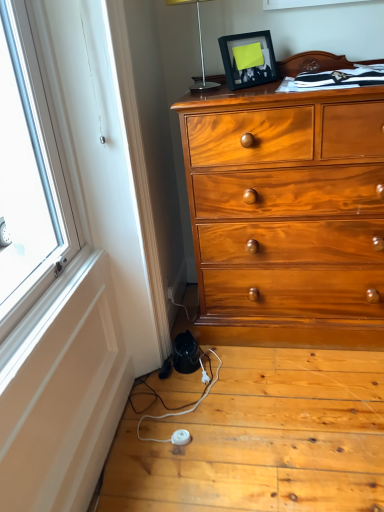
This screenshot has height=512, width=384. Find the location of `silver metallic table lamp at upper center`. silver metallic table lamp at upper center is located at coordinates (200, 50).

Describe the element at coordinates (182, 410) in the screenshot. I see `white plastic power strip at lower center` at that location.

This screenshot has height=512, width=384. Find the location of `black matte picture frame at upper center`. black matte picture frame at upper center is located at coordinates (251, 64).

Locate an element on the screen. silver metallic table lamp at upper center is located at coordinates (200, 50).

Is black matte picture frame at upper center positioned behind silver metallic table lamp at upper center?

Yes.

From a real-world perspective, is black matte picture frame at upper center above or below silver metallic table lamp at upper center?

In terms of real-world spatial position, black matte picture frame at upper center is below silver metallic table lamp at upper center.

From the image's perspective, between black matte picture frame at upper center and silver metallic table lamp at upper center, who is located below?

black matte picture frame at upper center appears lower in the image.

Does black matte picture frame at upper center have a lesser height compared to silver metallic table lamp at upper center?

Yes, black matte picture frame at upper center is shorter than silver metallic table lamp at upper center.

Is point (208, 392) more distant than point (249, 72)?

Yes.

Is the surface of white plastic power strip at lower center in direct contact with black matte picture frame at upper center?

white plastic power strip at lower center and black matte picture frame at upper center are not in contact.

From a real-world perspective, does white plastic power strip at lower center stand above black matte picture frame at upper center?

No, from a real-world perspective, white plastic power strip at lower center is not over black matte picture frame at upper center

This screenshot has width=384, height=512. I want to click on twin below the black matte picture frame at upper center (from a real-world perspective), so 182,410.

In order to click on table lamp behind the white plastic power strip at lower center in this screenshot , I will do `click(200, 50)`.

Is point (204, 393) closer to camera compared to point (199, 91)?

No, it is not.

From a real-world perspective, who is located lower, white plastic power strip at lower center or silver metallic table lamp at upper center?

In real-world perspective, white plastic power strip at lower center is lower.

Considering the sizes of objects white plastic power strip at lower center and silver metallic table lamp at upper center in the image provided, who is bigger, white plastic power strip at lower center or silver metallic table lamp at upper center?

silver metallic table lamp at upper center is bigger.

Image resolution: width=384 pixels, height=512 pixels. Identify the location of picture frame located on the right of silver metallic table lamp at upper center. (251, 64).

Which object is closer to the camera, silver metallic table lamp at upper center or black matte picture frame at upper center?

silver metallic table lamp at upper center.

In terms of width, does silver metallic table lamp at upper center look wider or thinner when compared to black matte picture frame at upper center?

In the image, silver metallic table lamp at upper center appears to be wider than black matte picture frame at upper center.

Is black matte picture frame at upper center in contact with white plastic power strip at lower center?

No, black matte picture frame at upper center is not beside white plastic power strip at lower center.

From a real-world perspective, which object stands above the other?

black matte picture frame at upper center.

Locate an element on the screen. picture frame positioned vertically above the white plastic power strip at lower center (from a real-world perspective) is located at coordinates (251, 64).

Between point (234, 74) and point (218, 358), which one is positioned in front?

The point (234, 74) is more forward.

Looking at this image, which is correct: silver metallic table lamp at upper center is inside white plastic power strip at lower center, or outside of it?

silver metallic table lamp at upper center is not inside white plastic power strip at lower center, it's outside.

Is point (199, 31) in front of point (160, 416)?

No, it is not.

What are the coordinates of `twin located on the left of silver metallic table lamp at upper center` in the screenshot? It's located at (182, 410).

Is silver metallic table lamp at upper center looking in the opposite direction of white plastic power strip at lower center?

silver metallic table lamp at upper center is not turned away from white plastic power strip at lower center.

Locate an element on the screen. picture frame below the silver metallic table lamp at upper center (from a real-world perspective) is located at coordinates point(251,64).

Where is `picture frame above the white plastic power strip at lower center (from a real-world perspective)`? picture frame above the white plastic power strip at lower center (from a real-world perspective) is located at coordinates (251, 64).

Considering their positions, is black matte picture frame at upper center positioned further to white plastic power strip at lower center than silver metallic table lamp at upper center?

silver metallic table lamp at upper center is positioned further to the anchor white plastic power strip at lower center.

When comparing their distances from silver metallic table lamp at upper center, does black matte picture frame at upper center or white plastic power strip at lower center seem closer?

black matte picture frame at upper center lies closer to silver metallic table lamp at upper center than the other object.

Estimate the real-world distances between objects in this image. Which object is closer to silver metallic table lamp at upper center, white plastic power strip at lower center or black matte picture frame at upper center?

black matte picture frame at upper center is closer to silver metallic table lamp at upper center.

Considering their positions, is silver metallic table lamp at upper center positioned closer to white plastic power strip at lower center than black matte picture frame at upper center?

black matte picture frame at upper center is positioned closer to the anchor white plastic power strip at lower center.

Which object lies further to the anchor point black matte picture frame at upper center, silver metallic table lamp at upper center or white plastic power strip at lower center?

The object further to black matte picture frame at upper center is white plastic power strip at lower center.

Considering their positions, is white plastic power strip at lower center positioned closer to black matte picture frame at upper center than silver metallic table lamp at upper center?

silver metallic table lamp at upper center.

Identify the location of picture frame between silver metallic table lamp at upper center and white plastic power strip at lower center vertically. The width and height of the screenshot is (384, 512). (251, 64).